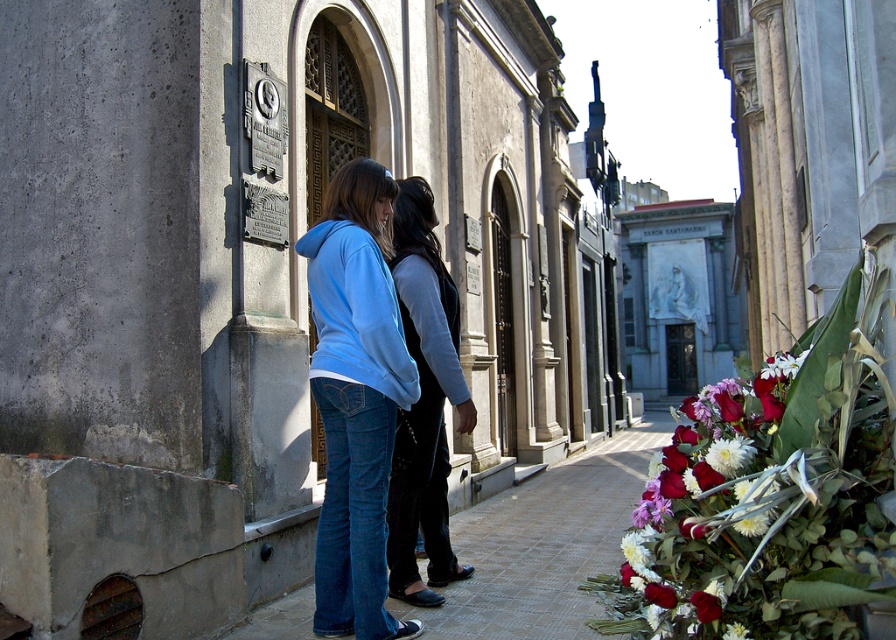
You are standing at the point with coordinates point [358,256]. You want to walk straight ahead. Will the point point [334,176] be visible in front of you?

Point [334,176] is behind point [358,256], so if you are standing at point [358,256] and walk straight ahead, the point [334,176] will not be visible in front of you since it is located behind your current position.

You are a photographer positioned at the entrance of the mausoleum. You need to capture a photo that includes both the vivid red petals at lower right and the black leather jacket at center. Based on their heights, will the jacket block the view of the petals in your shot?

The vivid red petals at lower right is not as tall as the black leather jacket at center, so the jacket may block the view of the petals depending on the angle and distance. To ensure both are visible, adjust the camera angle or move closer to avoid obstruction.